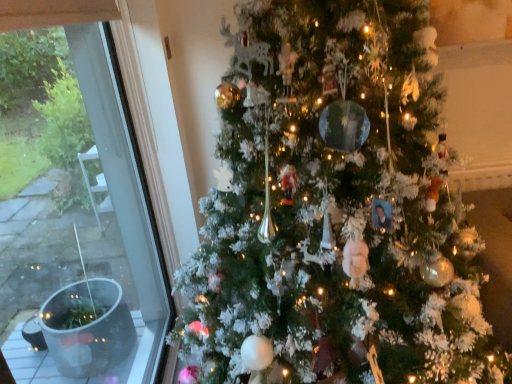
Where is `transparent glass window at left`? transparent glass window at left is located at coordinates click(x=122, y=148).

Measure the distance between point (32,2) and camera.

Point (32,2) is 37.64 inches from camera.

What do you see at coordinates (122, 148) in the screenshot?
I see `transparent glass window at left` at bounding box center [122, 148].

Where is `white frosted christmas tree at center`? white frosted christmas tree at center is located at coordinates click(x=335, y=207).

This screenshot has height=384, width=512. What do you see at coordinates (335, 207) in the screenshot?
I see `white frosted christmas tree at center` at bounding box center [335, 207].

You are a GUI agent. You are given a task and a screenshot of the screen. Output one action in this format:
    pyautogui.click(x=<x>, y=<y>)
    Task: Click on the transparent glass window at left
    This screenshot has height=384, width=512.
    Given the screenshot: What is the action you would take?
    pyautogui.click(x=122, y=148)

Is transparent glass window at left to the left of white frosted christmas tree at center from the viewer's perspective?

Indeed, transparent glass window at left is positioned on the left side of white frosted christmas tree at center.

Does transparent glass window at left come in front of white frosted christmas tree at center?

No, it is behind white frosted christmas tree at center.

Which is closer to the camera, (86,91) or (279,270)?

Clearly, point (86,91) is more distant from the camera than point (279,270).

From the picture: From the image's perspective, which is above, transparent glass window at left or white frosted christmas tree at center?

white frosted christmas tree at center.

From a real-world perspective, between transparent glass window at left and white frosted christmas tree at center, who is vertically higher?

In real-world perspective, white frosted christmas tree at center is above.

Considering the relative sizes of transparent glass window at left and white frosted christmas tree at center in the image provided, is transparent glass window at left wider than white frosted christmas tree at center?

No.

Can you confirm if transparent glass window at left is taller than white frosted christmas tree at center?

In fact, transparent glass window at left may be shorter than white frosted christmas tree at center.

In the scene shown: Which of these two, transparent glass window at left or white frosted christmas tree at center, is bigger?

Bigger between the two is white frosted christmas tree at center.

Which is correct: transparent glass window at left is inside white frosted christmas tree at center, or outside of it?

transparent glass window at left cannot be found inside white frosted christmas tree at center.

Is transparent glass window at left not close to white frosted christmas tree at center?

No, transparent glass window at left is not far away from white frosted christmas tree at center.

Is transparent glass window at left oriented away from white frosted christmas tree at center?

Yes.

What's the angular difference between transparent glass window at left and white frosted christmas tree at center's facing directions?

There is a 90.7-degree angle between the facing directions of transparent glass window at left and white frosted christmas tree at center.

The width and height of the screenshot is (512, 384). In order to click on window located underneath the white frosted christmas tree at center (from a real-world perspective) in this screenshot , I will do `click(122, 148)`.

Consider the image. Can you confirm if white frosted christmas tree at center is positioned to the right of transparent glass window at left?

Correct, you'll find white frosted christmas tree at center to the right of transparent glass window at left.

Which object is closer to the camera, white frosted christmas tree at center or transparent glass window at left?

white frosted christmas tree at center is more forward.

In the scene shown: Which is closer to the camera, [323,110] or [144,153]?

Point [323,110] is closer to the camera than point [144,153].

From the image's perspective, is white frosted christmas tree at center on transparent glass window at left?

Yes.

From a real-world perspective, which is physically below, white frosted christmas tree at center or transparent glass window at left?

transparent glass window at left.

Considering the sizes of white frosted christmas tree at center and transparent glass window at left in the image, is white frosted christmas tree at center wider or thinner than transparent glass window at left?

In the image, white frosted christmas tree at center appears to be wider than transparent glass window at left.

Is white frosted christmas tree at center taller or shorter than transparent glass window at left?

Considering their sizes, white frosted christmas tree at center has more height than transparent glass window at left.

Can you confirm if white frosted christmas tree at center is smaller than transparent glass window at left?

Incorrect, white frosted christmas tree at center is not smaller in size than transparent glass window at left.

Is white frosted christmas tree at center inside the boundaries of transparent glass window at left, or outside?

white frosted christmas tree at center exists outside the volume of transparent glass window at left.

Are white frosted christmas tree at center and transparent glass window at left located far from each other?

That's not correct — white frosted christmas tree at center is a little close to transparent glass window at left.

Could you tell me if white frosted christmas tree at center is turned towards transparent glass window at left?

No, white frosted christmas tree at center is not facing towards transparent glass window at left.

I want to click on christmas tree to the right of transparent glass window at left, so click(x=335, y=207).

Locate an element on the screen. This screenshot has height=384, width=512. christmas tree that is above the transparent glass window at left (from a real-world perspective) is located at coordinates (335, 207).

Image resolution: width=512 pixels, height=384 pixels. Find the location of `window on the left of white frosted christmas tree at center`. window on the left of white frosted christmas tree at center is located at coordinates (122, 148).